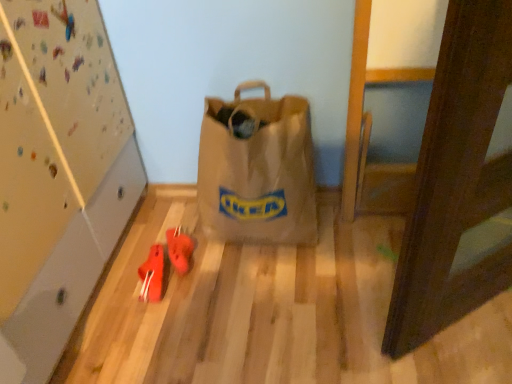
Locate an element on the screen. The image size is (512, 384). vacant space that's between brown paper bag at center and rubberized red shoes at center, the 2th footwear viewed from the left is located at coordinates 223,256.